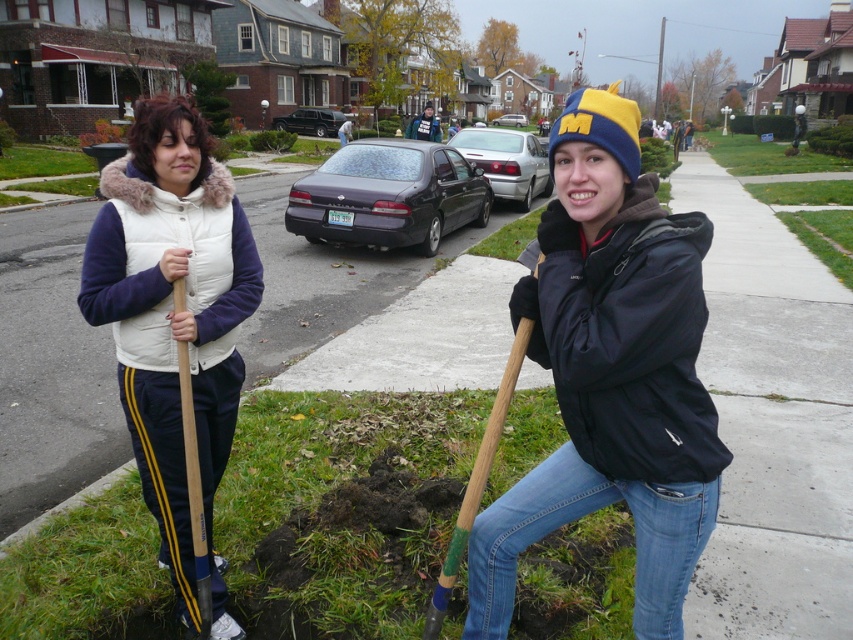
Can you confirm if white fleece vest at left is taller than wooden shovel at lower right?

Yes, white fleece vest at left is taller than wooden shovel at lower right.

Is white fleece vest at left to the right of wooden shovel at lower right from the viewer's perspective?

No, white fleece vest at left is not to the right of wooden shovel at lower right.

Which is behind, point (99, 237) or point (442, 582)?

The point (99, 237) is more distant.

Where is `white fleece vest at left`? This screenshot has height=640, width=853. white fleece vest at left is located at coordinates (x=173, y=317).

Is the position of matte black jacket at center more distant than that of wooden shovel at lower right?

No.

In the scene shown: Between matte black jacket at center and wooden shovel at lower right, which one appears on the left side from the viewer's perspective?

wooden shovel at lower right

Where is `matte black jacket at center`? matte black jacket at center is located at coordinates (611, 372).

Is point (689, 490) positioned before point (154, 168)?

Yes, point (689, 490) is closer to viewer.

Between matte black jacket at center and white fleece vest at left, which one appears on the left side from the viewer's perspective?

From the viewer's perspective, white fleece vest at left appears more on the left side.

Is point (469, 563) more distant than point (233, 385)?

No, it is in front of (233, 385).

Where is `matte black jacket at center`? The image size is (853, 640). matte black jacket at center is located at coordinates (611, 372).